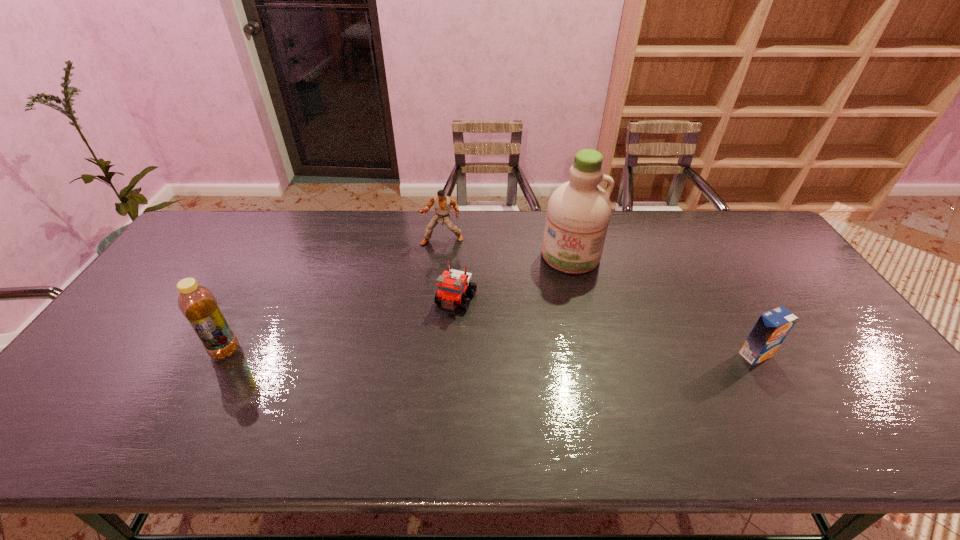
Find the location of a particular element. The height and width of the screenshot is (540, 960). the fourth shortest object is located at coordinates (197, 303).

Locate an element on the screen. This screenshot has height=540, width=960. the leftmost object is located at coordinates (197, 303).

Locate an element on the screen. the rightmost object is located at coordinates (772, 327).

Identify the location of the second shortest object. Image resolution: width=960 pixels, height=540 pixels. (772, 327).

The height and width of the screenshot is (540, 960). In order to click on cleansing agent in this screenshot , I will do `click(578, 213)`.

I want to click on the tallest object, so click(578, 213).

The height and width of the screenshot is (540, 960). Find the location of `the third shortest object`. the third shortest object is located at coordinates (443, 203).

At what (x,y) coordinates should I click in order to perform the action: click on the third nearest object. Please return your answer as a coordinate pair (x, y). This screenshot has height=540, width=960. Looking at the image, I should click on (451, 284).

This screenshot has width=960, height=540. In order to click on the shortest object in this screenshot , I will do `click(451, 284)`.

This screenshot has width=960, height=540. In order to click on free location located on the front of the fourth shortest object in this screenshot , I will do `click(199, 400)`.